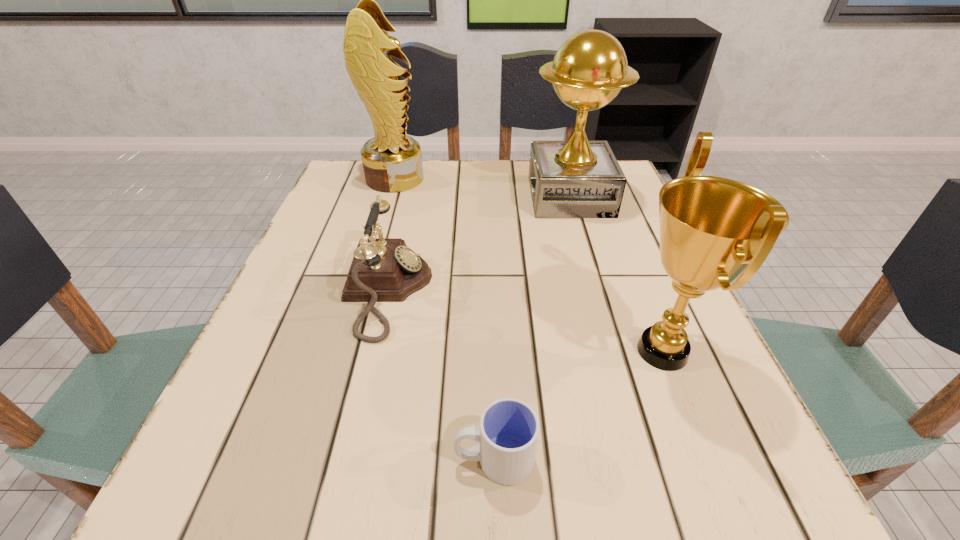
You are a GUI agent. You are given a task and a screenshot of the screen. Output one action in this format:
    pyautogui.click(x=<x>, y=<y>)
    Task: Click on the blank space at the right edge of the desktop
    The image size is (960, 540).
    Given the screenshot: What is the action you would take?
    pyautogui.click(x=617, y=303)

Image resolution: width=960 pixels, height=540 pixels. In order to click on vacant space at the near left corner of the desktop in this screenshot , I will do `click(174, 515)`.

What are the coordinates of `vacant space that's between the leftmost award and the nearest award` in the screenshot? It's located at (529, 265).

Locate an element on the screen. The width and height of the screenshot is (960, 540). empty location between the leftmost award and the telephone is located at coordinates (391, 235).

I want to click on free space between the telephone and the leftmost award, so click(391, 235).

Identify the location of vacant point located between the nearest award and the telephone. This screenshot has width=960, height=540. (525, 321).

Where is `free space between the nearest award and the fourth tallest object`? Image resolution: width=960 pixels, height=540 pixels. free space between the nearest award and the fourth tallest object is located at coordinates (525, 321).

Where is `vacant point located between the nearest award and the leftmost award`? The height and width of the screenshot is (540, 960). vacant point located between the nearest award and the leftmost award is located at coordinates (529, 265).

Where is `free space between the telephone and the nearest award`? free space between the telephone and the nearest award is located at coordinates (525, 321).

Image resolution: width=960 pixels, height=540 pixels. Identify the location of free space between the leftmost award and the telephone. (391, 235).